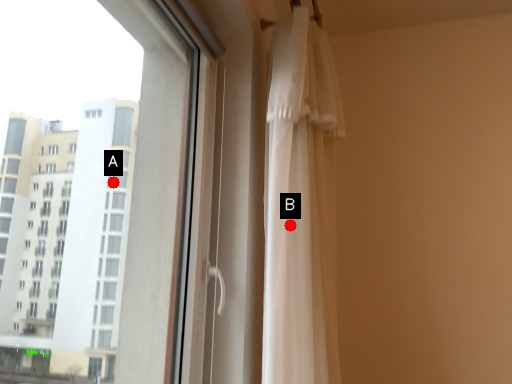
Question: Two points are circled on the image, labeled by A and B beside each circle. Which point is closer to the camera?

Choices:
 (A) A is closer
 (B) B is closer

Answer: (B)